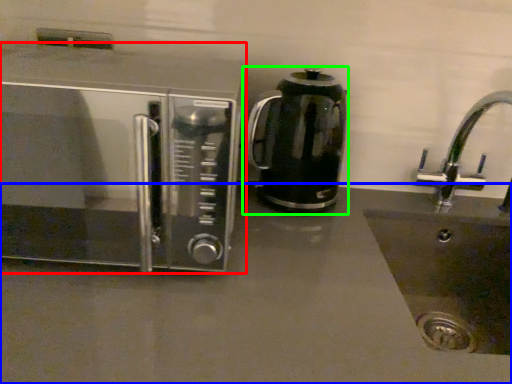
Question: Which object is positioned closest to microwave oven (highlighted by a red box)? Select from counter top (highlighted by a blue box) and kitchen appliance (highlighted by a green box).

Choices:
 (A) counter top
 (B) kitchen appliance

Answer: (B)